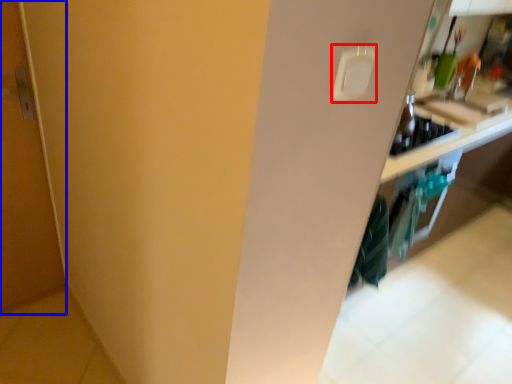
Question: Which object appears closest to the camera in this image, light switch (highlighted by a red box) or door (highlighted by a blue box)?

Choices:
 (A) light switch
 (B) door

Answer: (A)